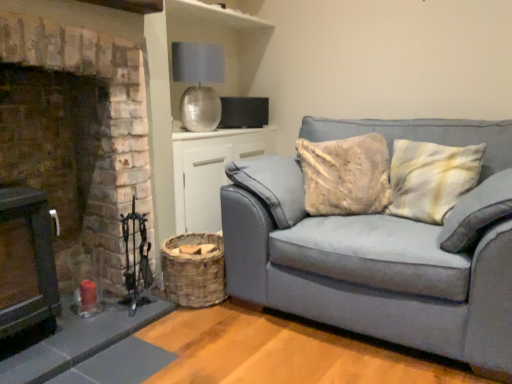
What is the approximate width of suede gray couch at right?

suede gray couch at right is 38.78 inches wide.

Where is `suede gray couch at right`? suede gray couch at right is located at coordinates (374, 270).

This screenshot has height=384, width=512. What do you see at coordinates (198, 83) in the screenshot?
I see `metallic silver lampshade at upper center` at bounding box center [198, 83].

What do you see at coordinates (194, 271) in the screenshot? Image resolution: width=512 pixels, height=384 pixels. I see `woven brown basket at lower left` at bounding box center [194, 271].

The image size is (512, 384). Identify the location of woven wood basket at lower center. (210, 171).

Find the location of a particular element. This screenshot has height=384, width=512. brick fireplace at left is located at coordinates (75, 130).

Considering the sizes of objects brick fireplace at left and woven brown basket at lower left in the image provided, who is wider, brick fireplace at left or woven brown basket at lower left?

brick fireplace at left is wider.

Measure the distance from brick fireplace at left to woven brown basket at lower left.

brick fireplace at left and woven brown basket at lower left are 19.74 inches apart.

Does brick fireplace at left turn towards woven brown basket at lower left?

No, brick fireplace at left does not turn towards woven brown basket at lower left.

Between brick fireplace at left and woven brown basket at lower left, which one appears on the left side from the viewer's perspective?

brick fireplace at left is more to the left.

From a real-world perspective, which is physically below, brick fireplace at left or metallic silver lampshade at upper center?

brick fireplace at left, from a real-world perspective.

Could metallic silver lampshade at upper center be considered to be inside brick fireplace at left?

Definitely not — metallic silver lampshade at upper center is not inside brick fireplace at left.

From the image's perspective, does brick fireplace at left appear lower than metallic silver lampshade at upper center?

Yes, from the image's perspective, brick fireplace at left is beneath metallic silver lampshade at upper center.

Does brick fireplace at left have a larger size compared to metallic silver lampshade at upper center?

Indeed, brick fireplace at left has a larger size compared to metallic silver lampshade at upper center.

Is point (249, 149) closer or farther from the camera than point (399, 293)?

Point (249, 149) is farther from the camera than point (399, 293).

Is woven wood basket at lower center positioned behind suede gray couch at right?

Yes, the depth of woven wood basket at lower center is greater than that of suede gray couch at right.

This screenshot has height=384, width=512. I want to click on studio couch below the woven wood basket at lower center (from the image's perspective), so point(374,270).

From the image's perspective, between woven wood basket at lower center and woven brown basket at lower left, which one is located above?

woven wood basket at lower center is shown above in the image.

Can you confirm if woven wood basket at lower center is positioned to the left of woven brown basket at lower left?

Incorrect, woven wood basket at lower center is not on the left side of woven brown basket at lower left.

In the scene shown: How distant is woven wood basket at lower center from woven brown basket at lower left?

woven wood basket at lower center and woven brown basket at lower left are 18.80 inches apart.

Is woven wood basket at lower center facing towards woven brown basket at lower left?

Yes, woven wood basket at lower center is aimed at woven brown basket at lower left.

How far apart are woven brown basket at lower left and woven wood basket at lower center?

woven brown basket at lower left is 47.75 centimeters from woven wood basket at lower center.

Considering the relative sizes of woven brown basket at lower left and woven wood basket at lower center in the image provided, is woven brown basket at lower left thinner than woven wood basket at lower center?

Incorrect, the width of woven brown basket at lower left is not less than that of woven wood basket at lower center.

Which of these two, woven brown basket at lower left or woven wood basket at lower center, stands shorter?

woven brown basket at lower left is shorter.

Identify the location of table above the woven brown basket at lower left (from a real-world perspective). (210, 171).

Is woven wood basket at lower center in contact with brick fireplace at left?

No, woven wood basket at lower center is not touching brick fireplace at left.

Considering the positions of point (231, 131) and point (104, 268), is point (231, 131) closer or farther from the camera than point (104, 268)?

Point (231, 131) is farther from the camera than point (104, 268).

From a real-world perspective, is woven wood basket at lower center positioned above or below brick fireplace at left?

From a real-world perspective, woven wood basket at lower center is physically below brick fireplace at left.

Does woven wood basket at lower center lie in front of brick fireplace at left?

No, it is behind brick fireplace at left.

Looking at this image, which of these two, woven brown basket at lower left or suede gray couch at right, stands taller?

With more height is suede gray couch at right.

In the image, is woven brown basket at lower left positioned in front of or behind suede gray couch at right?

In the image, woven brown basket at lower left appears behind suede gray couch at right.

Can you confirm if woven brown basket at lower left is positioned to the left of suede gray couch at right?

Yes.

The image size is (512, 384). In order to click on basket below the brick fireplace at left (from the image's perspective) in this screenshot , I will do `click(194, 271)`.

Where is `lamp above the brick fireplace at left (from the image's perspective)`? The width and height of the screenshot is (512, 384). lamp above the brick fireplace at left (from the image's perspective) is located at coordinates (198, 83).

In the scene shown: Which object lies nearer to the anchor point woven wood basket at lower center, suede gray couch at right or brick fireplace at left?

Among the two, brick fireplace at left is located nearer to woven wood basket at lower center.

Looking at the image, which one is located closer to woven brown basket at lower left, metallic silver lampshade at upper center or brick fireplace at left?

brick fireplace at left lies closer to woven brown basket at lower left than the other object.

When comparing their distances from metallic silver lampshade at upper center, does woven brown basket at lower left or brick fireplace at left seem further?

woven brown basket at lower left lies further to metallic silver lampshade at upper center than the other object.

Looking at the image, which one is located further to woven wood basket at lower center, metallic silver lampshade at upper center or woven brown basket at lower left?

Among the two, woven brown basket at lower left is located further to woven wood basket at lower center.

Looking at the image, which one is located closer to metallic silver lampshade at upper center, brick fireplace at left or suede gray couch at right?

brick fireplace at left lies closer to metallic silver lampshade at upper center than the other object.

Based on the photo, looking at the image, which one is located further to suede gray couch at right, woven brown basket at lower left or woven wood basket at lower center?

woven wood basket at lower center is further to suede gray couch at right.

From the image, which object appears to be nearer to woven brown basket at lower left, suede gray couch at right or metallic silver lampshade at upper center?

suede gray couch at right is positioned closer to the anchor woven brown basket at lower left.

Estimate the real-world distances between objects in this image. Which object is further from suede gray couch at right, woven brown basket at lower left or metallic silver lampshade at upper center?

Based on the image, metallic silver lampshade at upper center appears to be further to suede gray couch at right.

Locate an element on the screen. studio couch that lies between metallic silver lampshade at upper center and woven brown basket at lower left from top to bottom is located at coordinates (374, 270).

Identify the location of lamp between brick fireplace at left and suede gray couch at right in the horizontal direction. The height and width of the screenshot is (384, 512). (198, 83).

Where is `basket between brick fireplace at left and suede gray couch at right`? This screenshot has height=384, width=512. basket between brick fireplace at left and suede gray couch at right is located at coordinates (194, 271).

Identify the location of table between brick fireplace at left and metallic silver lampshade at upper center along the z-axis. The height and width of the screenshot is (384, 512). (210, 171).